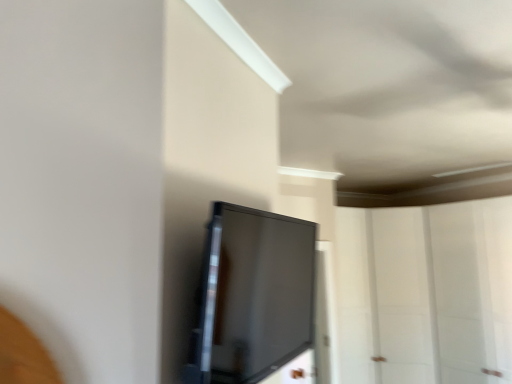
Image resolution: width=512 pixels, height=384 pixels. What do you see at coordinates (252, 296) in the screenshot?
I see `matte black screen at center` at bounding box center [252, 296].

Measure the distance between point (234, 372) and camera.

A distance of 38.54 inches exists between point (234, 372) and camera.

Locate an element on the screen. The width and height of the screenshot is (512, 384). matte black screen at center is located at coordinates (252, 296).

Identify the location of transparent glass door at center. The height and width of the screenshot is (384, 512). (426, 292).

What do you see at coordinates (426, 292) in the screenshot? The width and height of the screenshot is (512, 384). I see `transparent glass door at center` at bounding box center [426, 292].

What is the approximate width of transparent glass door at center?

transparent glass door at center is 32.39 inches in width.

Where is `matte black screen at center`? Image resolution: width=512 pixels, height=384 pixels. matte black screen at center is located at coordinates [x=252, y=296].

Would you say matte black screen at center is to the left or to the right of transparent glass door at center in the picture?

In the image, matte black screen at center appears on the left side of transparent glass door at center.

Does matte black screen at center lie behind transparent glass door at center?

No, the depth of matte black screen at center is less than that of transparent glass door at center.

Which is closer, (201, 307) or (434, 333)?

The point (201, 307) is closer.

Based on the photo, from the image's perspective, is matte black screen at center above or below transparent glass door at center?

A: Clearly, from the image's perspective, matte black screen at center is above transparent glass door at center.

From a real-world perspective, who is located higher, matte black screen at center or transparent glass door at center?

matte black screen at center.

Considering the sizes of matte black screen at center and transparent glass door at center in the image, is matte black screen at center wider or thinner than transparent glass door at center?

In the image, matte black screen at center appears to be more narrow than transparent glass door at center.

Between matte black screen at center and transparent glass door at center, which one has less height?

matte black screen at center.

Can you confirm if matte black screen at center is bigger than transparent glass door at center?

No, matte black screen at center is not bigger than transparent glass door at center.

Does matte black screen at center contain transparent glass door at center?

No, matte black screen at center does not contain transparent glass door at center.

Is matte black screen at center placed right next to transparent glass door at center?

matte black screen at center and transparent glass door at center are clearly separated.

Is matte black screen at center aimed at transparent glass door at center?

No.

How different are the orientations of matte black screen at center and transparent glass door at center in degrees?

The facing directions of matte black screen at center and transparent glass door at center are 35.3 degrees apart.

At what (x,y) coordinates should I click in order to perform the action: click on screen in front of the transparent glass door at center. Please return your answer as a coordinate pair (x, y). The height and width of the screenshot is (384, 512). Looking at the image, I should click on (252, 296).

Between transparent glass door at center and matte black screen at center, which one appears on the right side from the viewer's perspective?

Positioned to the right is transparent glass door at center.

Which object is further away from the camera, transparent glass door at center or matte black screen at center?

transparent glass door at center is more distant.

Considering the points (460, 351) and (224, 374), which point is behind, point (460, 351) or point (224, 374)?

The point (460, 351) is more distant.

From the image's perspective, between transparent glass door at center and matte black screen at center, which one is located above?

matte black screen at center, from the image's perspective.

Based on the photo, from a real-world perspective, who is located higher, transparent glass door at center or matte black screen at center?

In real-world perspective, matte black screen at center is above.

Does transparent glass door at center have a greater width compared to matte black screen at center?

Correct, the width of transparent glass door at center exceeds that of matte black screen at center.

Is transparent glass door at center taller than matte black screen at center?

Yes.

Considering the relative sizes of transparent glass door at center and matte black screen at center in the image provided, is transparent glass door at center smaller than matte black screen at center?

No.

Is transparent glass door at center inside the boundaries of matte black screen at center, or outside?

transparent glass door at center is outside matte black screen at center.

Is transparent glass door at center far away from matte black screen at center?

A: Yes, transparent glass door at center and matte black screen at center are located far from each other.

Does transparent glass door at center turn towards matte black screen at center?

No.

What's the angular difference between transparent glass door at center and matte black screen at center's facing directions?

35.3 degrees.

Image resolution: width=512 pixels, height=384 pixels. Identify the location of glass door that is under the matte black screen at center (from a real-world perspective). (426, 292).

At what (x,y) coordinates should I click in order to perform the action: click on screen located above the transparent glass door at center (from the image's perspective). Please return your answer as a coordinate pair (x, y). The height and width of the screenshot is (384, 512). Looking at the image, I should click on (252, 296).

Locate an element on the screen. The height and width of the screenshot is (384, 512). glass door behind the matte black screen at center is located at coordinates click(426, 292).